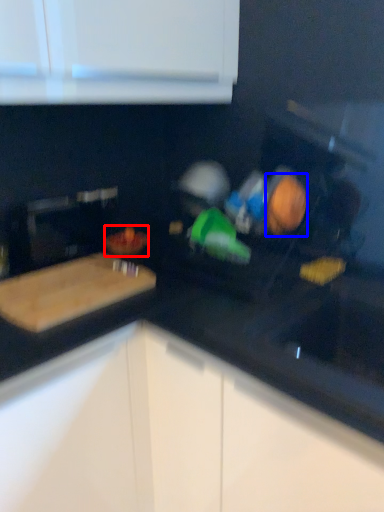
Question: Which of the following is the closest to the observer, food (highlighted by a red box) or food (highlighted by a blue box)?

Choices:
 (A) food
 (B) food

Answer: (B)